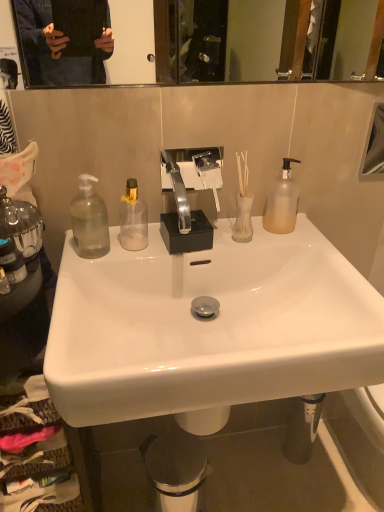
What is the approximate height of transparent plastic bottle at left, the 3th bottle when ordered from right to left?

7.24 inches.

This screenshot has width=384, height=512. What are the coordinates of `glossy glass mirror at upper right` in the screenshot? It's located at (374, 145).

The height and width of the screenshot is (512, 384). I want to click on translucent glass vase at center, so click(x=243, y=220).

The height and width of the screenshot is (512, 384). Describe the element at coordinates (4, 283) in the screenshot. I see `clear glass soap dispenser at left, the 2th bottle in the left-to-right sequence` at that location.

Identify the location of metallic trash can at lower center. (175, 470).

Describe the element at coordinates (133, 219) in the screenshot. I see `transparent plastic bottle at center, acting as the 2th bottle starting from the right` at that location.

You are a GUI agent. You are given a task and a screenshot of the screen. Output one action in this format:
    pyautogui.click(x=<x>, y=<y>)
    Task: Click on the white glossy sink at center
    
    Given the screenshot: What is the action you would take?
    pyautogui.click(x=209, y=328)

Identify the location of transparent plastic bottle at left, the 3th bottle positioned from the left. (89, 221).

Can you confirm if translucent glass vase at center is thinner than metallic trash can at lower center?

Yes.

Which object is further away from the camera, translucent glass vase at center or metallic trash can at lower center?

Positioned behind is metallic trash can at lower center.

In terms of height, does translucent glass vase at center look taller or shorter compared to metallic trash can at lower center?

Considering their sizes, translucent glass vase at center has less height than metallic trash can at lower center.

Considering the sizes of objects clear glass soap dispenser at left, positioned as the 4th bottle in right-to-left order, and transparent plastic bottle at left, the 3th bottle when ordered from right to left, in the image provided, who is smaller, clear glass soap dispenser at left, positioned as the 4th bottle in right-to-left order, or transparent plastic bottle at left, the 3th bottle when ordered from right to left,?

With smaller size is clear glass soap dispenser at left, positioned as the 4th bottle in right-to-left order.

Where is `the 2nd bottle behind the clear glass soap dispenser at left, the 2th bottle in the left-to-right sequence, counting from the anchor's position`? the 2nd bottle behind the clear glass soap dispenser at left, the 2th bottle in the left-to-right sequence, counting from the anchor's position is located at coordinates (89, 221).

Is clear glass soap dispenser at left, positioned as the 4th bottle in right-to-left order, taller than transparent plastic bottle at left, the 3th bottle when ordered from right to left?

No, clear glass soap dispenser at left, positioned as the 4th bottle in right-to-left order, is not taller than transparent plastic bottle at left, the 3th bottle when ordered from right to left.

Based on the photo, is clear glass soap dispenser at left, the 2th bottle in the left-to-right sequence, turned away from transparent plastic bottle at left, the 3th bottle positioned from the left?

No.

Between clear glass soap dispenser at left, the 2th bottle in the left-to-right sequence, and transparent plastic bottle at center, which is the fourth bottle from left to right, which one has smaller width?

Thinner between the two is clear glass soap dispenser at left, the 2th bottle in the left-to-right sequence.

Which object is further away from the camera taking this photo, clear glass soap dispenser at left, positioned as the 4th bottle in right-to-left order, or transparent plastic bottle at center, acting as the 2th bottle starting from the right?

transparent plastic bottle at center, acting as the 2th bottle starting from the right.

How much distance is there between clear glass soap dispenser at left, the 2th bottle in the left-to-right sequence, and transparent plastic bottle at center, acting as the 2th bottle starting from the right?

They are 13.46 inches apart.

Could you tell me if clear glass soap dispenser at left, positioned as the 4th bottle in right-to-left order, is facing transparent plastic bottle at center, which is the fourth bottle from left to right?

No, clear glass soap dispenser at left, positioned as the 4th bottle in right-to-left order, is not facing towards transparent plastic bottle at center, which is the fourth bottle from left to right.

Is transparent plastic bottle at center, which is the fourth bottle from left to right, surrounded by glossy glass mirror at upper right?

No, glossy glass mirror at upper right does not contain transparent plastic bottle at center, which is the fourth bottle from left to right.

Between glossy glass mirror at upper right and transparent plastic bottle at center, acting as the 2th bottle starting from the right, which one appears on the right side from the viewer's perspective?

glossy glass mirror at upper right.

Which object is further away from the camera taking this photo, glossy glass mirror at upper right or transparent plastic bottle at center, acting as the 2th bottle starting from the right?

glossy glass mirror at upper right is further from the camera.

Is glossy glass mirror at upper right positioned far away from transparent plastic bottle at center, which is the fourth bottle from left to right?

glossy glass mirror at upper right is actually quite close to transparent plastic bottle at center, which is the fourth bottle from left to right.

What's the angular difference between clear glass soap dispenser at left, the first bottle when ordered from left to right, and frosted glass pump bottle at right, the fifth bottle from the left,'s facing directions?

They differ by 0.000794 degrees in their facing directions.

Which object is thinner, clear glass soap dispenser at left, the first bottle when ordered from left to right, or frosted glass pump bottle at right, the fifth bottle from the left?

With smaller width is clear glass soap dispenser at left, the first bottle when ordered from left to right.

Is clear glass soap dispenser at left, the first bottle when ordered from left to right, next to frosted glass pump bottle at right, the fifth bottle from the left?

There is a gap between clear glass soap dispenser at left, the first bottle when ordered from left to right, and frosted glass pump bottle at right, the fifth bottle from the left.

Considering the positions of point (13, 278) and point (288, 224), is point (13, 278) closer or farther from the camera than point (288, 224)?

Point (13, 278) is closer to the camera than point (288, 224).

From the translucent glass vase at center, count the 2nd bottle to the left and point to it. Please provide its 2D coordinates.

[(89, 221)]

Can you confirm if translucent glass vase at center is smaller than transparent plastic bottle at left, the 3th bottle when ordered from right to left?

Yes.

How much distance is there between translucent glass vase at center and transparent plastic bottle at left, the 3th bottle positioned from the left?

translucent glass vase at center is 12.73 inches from transparent plastic bottle at left, the 3th bottle positioned from the left.

In the scene shown: What's the angular difference between translucent glass vase at center and transparent plastic bottle at left, the 3th bottle positioned from the left,'s facing directions?

The angular difference between translucent glass vase at center and transparent plastic bottle at left, the 3th bottle positioned from the left, is 0.00564 degrees.

Could you tell me if transparent plastic bottle at left, the 3th bottle when ordered from right to left, is facing metallic trash can at lower center?

No, transparent plastic bottle at left, the 3th bottle when ordered from right to left, is not oriented towards metallic trash can at lower center.

Considering the relative sizes of transparent plastic bottle at left, the 3th bottle positioned from the left, and metallic trash can at lower center in the image provided, is transparent plastic bottle at left, the 3th bottle positioned from the left, taller than metallic trash can at lower center?

No, transparent plastic bottle at left, the 3th bottle positioned from the left, is not taller than metallic trash can at lower center.

From the picture: Do you think transparent plastic bottle at left, the 3th bottle positioned from the left, is within metallic trash can at lower center, or outside of it?

transparent plastic bottle at left, the 3th bottle positioned from the left, exists outside the volume of metallic trash can at lower center.

From the image's perspective, is transparent plastic bottle at left, the 3th bottle when ordered from right to left, over metallic trash can at lower center?

Correct, transparent plastic bottle at left, the 3th bottle when ordered from right to left, appears higher than metallic trash can at lower center in the image.

Where is `trash bin/can that appears on the left of translucent glass vase at center`? The height and width of the screenshot is (512, 384). trash bin/can that appears on the left of translucent glass vase at center is located at coordinates (175, 470).

Locate an element on the screen. This screenshot has height=512, width=384. bottle that is the 2nd object located above the clear glass soap dispenser at left, positioned as the 4th bottle in right-to-left order (from the image's perspective) is located at coordinates (89, 221).

Considering their positions, is transparent plastic bottle at left, the 3th bottle when ordered from right to left, positioned closer to glossy glass mirror at upper right than clear glass soap dispenser at left, the first bottle when ordered from left to right?

transparent plastic bottle at left, the 3th bottle when ordered from right to left, is closer to glossy glass mirror at upper right.

Which object lies further to the anchor point frosted glass pump bottle at right, the fifth bottle from the left, transparent plastic bottle at center, which is the fourth bottle from left to right, or metallic trash can at lower center?

metallic trash can at lower center is positioned further to the anchor frosted glass pump bottle at right, the fifth bottle from the left.

From the image, which object appears to be farther from clear glass soap dispenser at left, positioned as the 4th bottle in right-to-left order, transparent plastic bottle at left, the 3th bottle positioned from the left, or frosted glass pump bottle at right, the fifth bottle from the left?

Based on the image, frosted glass pump bottle at right, the fifth bottle from the left, appears to be further to clear glass soap dispenser at left, positioned as the 4th bottle in right-to-left order.

Estimate the real-world distances between objects in this image. Which object is further from metallic trash can at lower center, clear glass soap dispenser at left, acting as the 5th bottle starting from the right, or white glossy sink at center?

Among the two, clear glass soap dispenser at left, acting as the 5th bottle starting from the right, is located further to metallic trash can at lower center.

Estimate the real-world distances between objects in this image. Which object is further from transparent plastic bottle at center, acting as the 2th bottle starting from the right, translucent glass vase at center or clear glass soap dispenser at left, acting as the 5th bottle starting from the right?

clear glass soap dispenser at left, acting as the 5th bottle starting from the right, is further to transparent plastic bottle at center, acting as the 2th bottle starting from the right.

Based on their spatial positions, is transparent plastic bottle at center, acting as the 2th bottle starting from the right, or white glossy sink at center further from glossy glass mirror at upper right?

Among the two, transparent plastic bottle at center, acting as the 2th bottle starting from the right, is located further to glossy glass mirror at upper right.

Which object lies further to the anchor point transparent plastic bottle at left, the 3th bottle positioned from the left, metallic trash can at lower center or glossy glass mirror at upper right?

glossy glass mirror at upper right lies further to transparent plastic bottle at left, the 3th bottle positioned from the left, than the other object.

From the image, which object appears to be farther from translucent glass vase at center, transparent plastic bottle at center, which is the fourth bottle from left to right, or clear glass soap dispenser at left, acting as the 5th bottle starting from the right?

clear glass soap dispenser at left, acting as the 5th bottle starting from the right, is positioned further to the anchor translucent glass vase at center.

Where is `sink between clear glass soap dispenser at left, the 2th bottle in the left-to-right sequence, and translucent glass vase at center`? This screenshot has width=384, height=512. sink between clear glass soap dispenser at left, the 2th bottle in the left-to-right sequence, and translucent glass vase at center is located at coordinates (209, 328).

At what (x,y) coordinates should I click in order to perform the action: click on bottle between transparent plastic bottle at left, the 3th bottle when ordered from right to left, and frosted glass pump bottle at right, the first bottle from the right, from left to right. Please return your answer as a coordinate pair (x, y). The height and width of the screenshot is (512, 384). Looking at the image, I should click on coord(133,219).

Identify the location of sink situated between transparent plastic bottle at center, which is the fourth bottle from left to right, and frosted glass pump bottle at right, the first bottle from the right, from left to right. The height and width of the screenshot is (512, 384). (209, 328).

The width and height of the screenshot is (384, 512). What are the coordinates of `bottle between translucent glass vase at center and glossy glass mirror at upper right in the horizontal direction` in the screenshot? It's located at (282, 202).